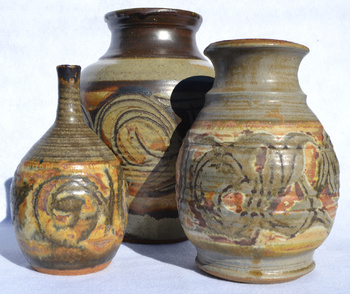
Image resolution: width=350 pixels, height=294 pixels. I want to click on bigger clay pot, so click(x=246, y=201).